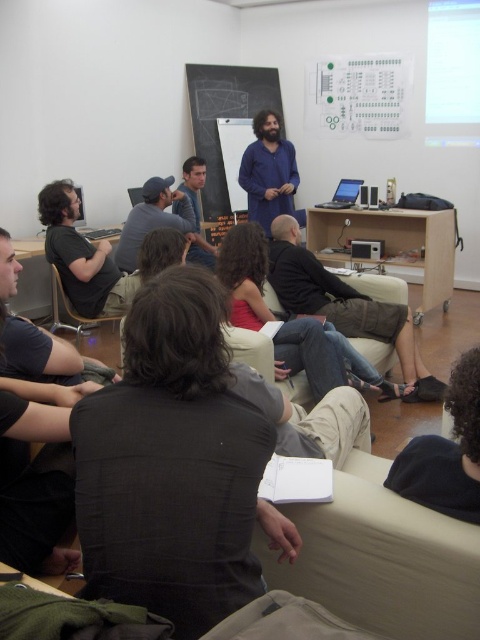
Question: Estimate the real-world distances between objects in this image. Which object is farther from the blue cotton shirt at center?

Choices:
 (A) silver metallic laptop at center
 (B) dark gray shirt at left
 (C) matte blue shirt at center
 (D) matte black cap at center

Answer: (B)

Question: Considering the real-world distances, which object is farthest from the dark gray shirt at left?

Choices:
 (A) matte black armchair at center
 (B) silver metallic laptop at center
 (C) matte black projector at center
 (D) black cotton shirt at center

Answer: (B)

Question: Is dark gray shirt at left to the right of silver metallic laptop at center from the viewer's perspective?

Choices:
 (A) yes
 (B) no

Answer: (B)

Question: Is blue cotton shirt at center bigger than matte black projector at center?

Choices:
 (A) no
 (B) yes

Answer: (B)

Question: Which point is farther to the camera?

Choices:
 (A) matte blue shirt at center
 (B) matte black cap at center

Answer: (A)

Question: Does black cotton shirt at center appear on the left side of matte black shirt at left?

Choices:
 (A) no
 (B) yes

Answer: (A)